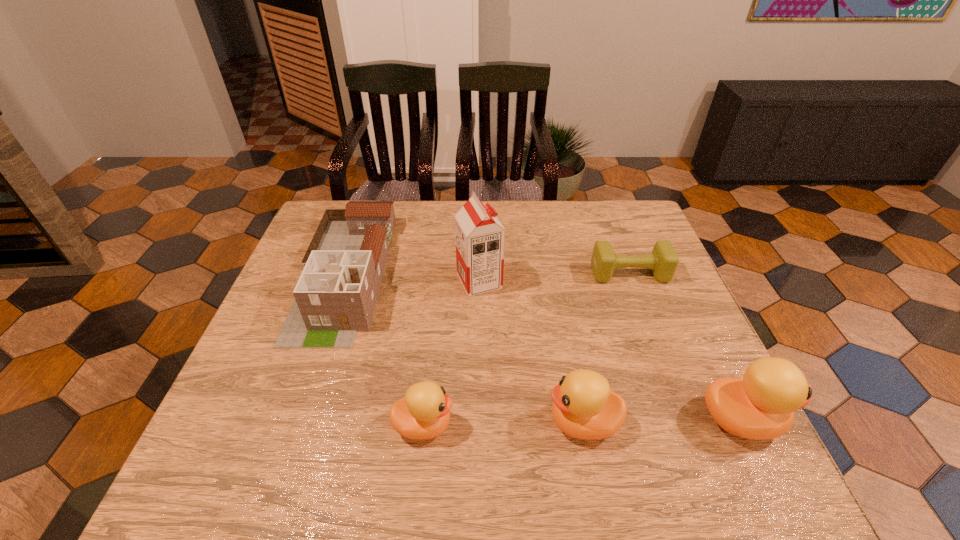
This screenshot has width=960, height=540. I want to click on vacant area that satisfies the following two spatial constraints: 1. at the main entrance of the leftmost object; 2. on the right side of the soya milk, so click(x=343, y=281).

Identify the location of free spot that satisfies the following two spatial constraints: 1. at the main entrance of the dollhouse; 2. on the right side of the soya milk. The image size is (960, 540). (343, 281).